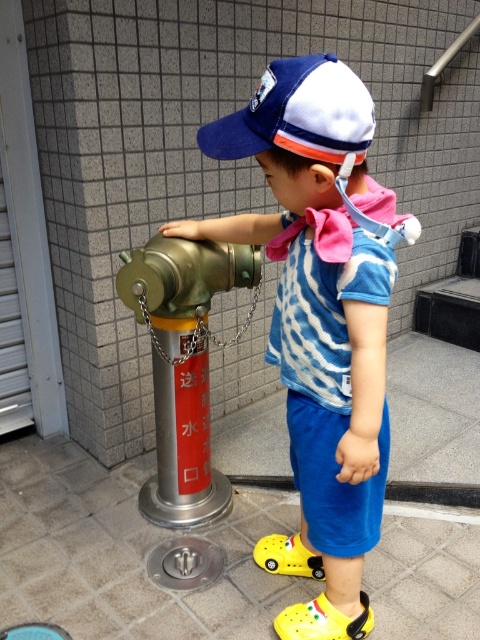
Does blue cotton shirt at center appear over metallic hydrant at center?

Yes.

Consider the image. Is blue cotton shirt at center to the left of metallic hydrant at center from the viewer's perspective?

In fact, blue cotton shirt at center is to the right of metallic hydrant at center.

At what (x,y) coordinates should I click in order to perform the action: click on blue cotton shirt at center. Please return your answer as a coordinate pair (x, y). This screenshot has height=640, width=480. Looking at the image, I should click on (321, 320).

Who is taller, metallic hydrant at center or blue/white mesh baseball cap at upper center?

metallic hydrant at center is taller.

Is metallic hydrant at center below blue/white mesh baseball cap at upper center?

Indeed, metallic hydrant at center is positioned under blue/white mesh baseball cap at upper center.

From the picture: Who is more forward, (187, 244) or (357, 129)?

Point (357, 129) is more forward.

Identify the location of metallic hydrant at center. The width and height of the screenshot is (480, 640). (183, 365).

Is blue cotton shirt at center positioned behind blue/white mesh baseball cap at upper center?

That is True.

Who is taller, blue cotton shirt at center or blue/white mesh baseball cap at upper center?

blue cotton shirt at center is taller.

The width and height of the screenshot is (480, 640). What do you see at coordinates (321, 320) in the screenshot?
I see `blue cotton shirt at center` at bounding box center [321, 320].

The height and width of the screenshot is (640, 480). I want to click on blue cotton shirt at center, so click(321, 320).